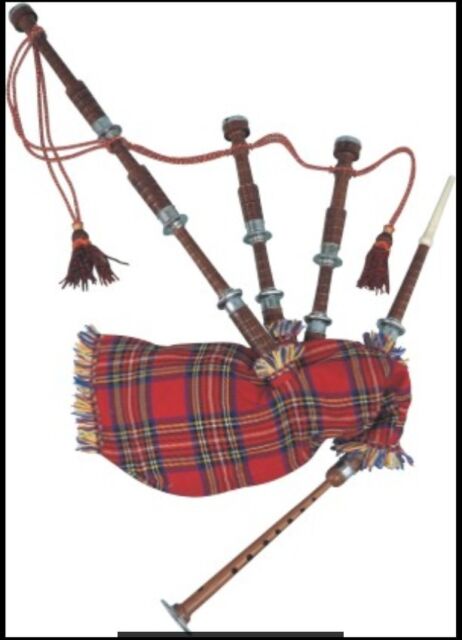
Find the location of `frame`. frame is located at coordinates (0, 304).